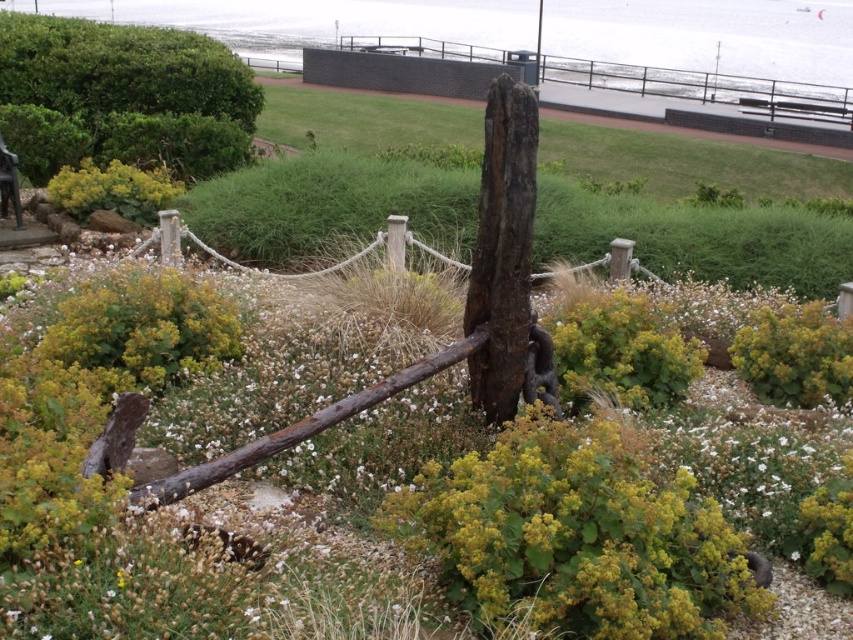
You are a gardener who needs to water the green leafy bush at upper left and the wooden park bench at lower left. Your watering can holds enough water to cover 2 meters. Can you water both without refilling?

The distance between the green leafy bush at upper left and the wooden park bench at lower left is 2.13 meters, which exceeds the watering can range of 2 meters. You will need to refill before reaching both.